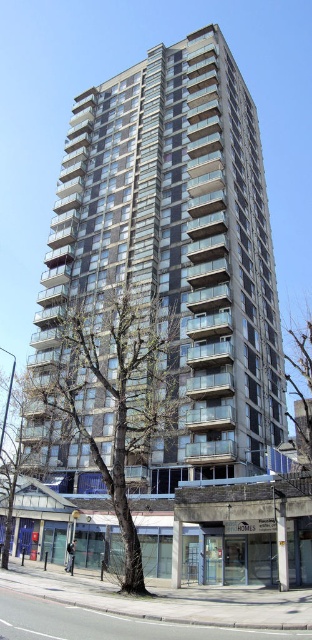
You are standing in front of the residential building and notice two green leafy trees. One is the green leafy tree at lower left and the other is the green leafy tree at center. Which tree would appear larger in your view?

The green leafy tree at lower left appears larger because it is closer to the viewer than the green leafy tree at center.

You are standing on the sidewalk in front of the glassy concrete building at center and the green leafy tree at center. Which object is taller?

The glassy concrete building at center is much taller than the green leafy tree at center.